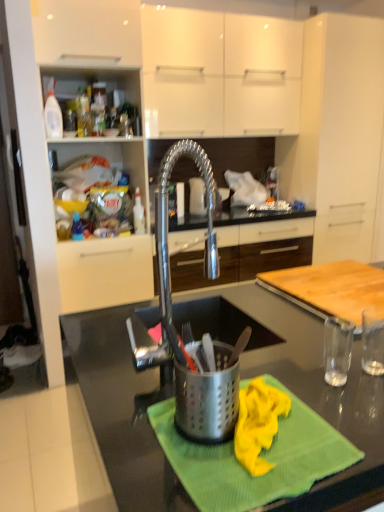
Image resolution: width=384 pixels, height=512 pixels. Identify the location of vacant space that is to the left of stainless steel utensil holder at center. (124, 414).